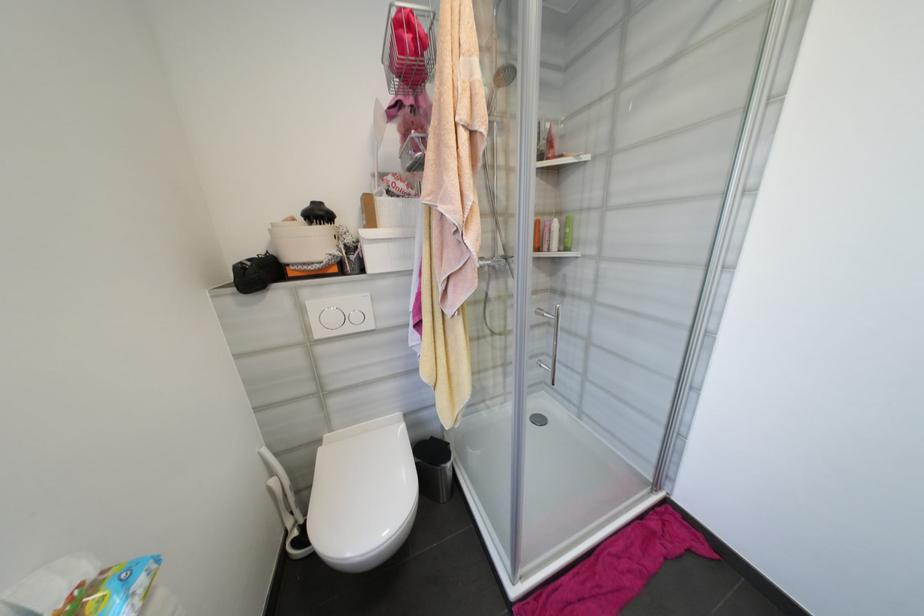
Describe the element at coordinates (503, 76) in the screenshot. I see `the shower head` at that location.